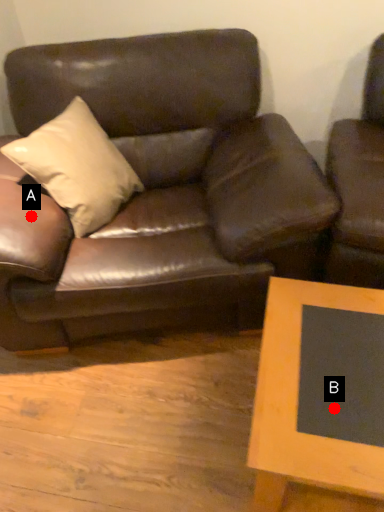
Question: Two points are circled on the image, labeled by A and B beside each circle. Which point is farther from the camera taking this photo?

Choices:
 (A) A is further
 (B) B is further

Answer: (A)